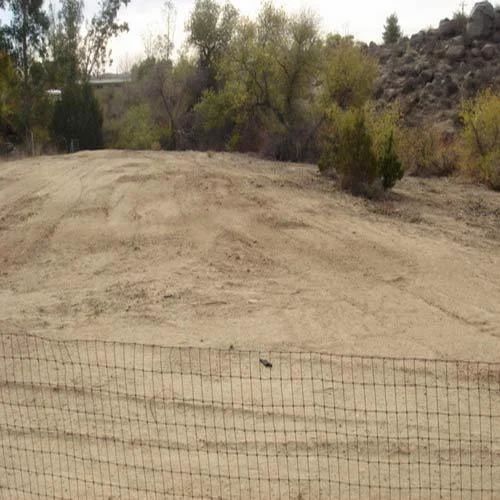
I want to click on trash on floor, so click(x=265, y=365).